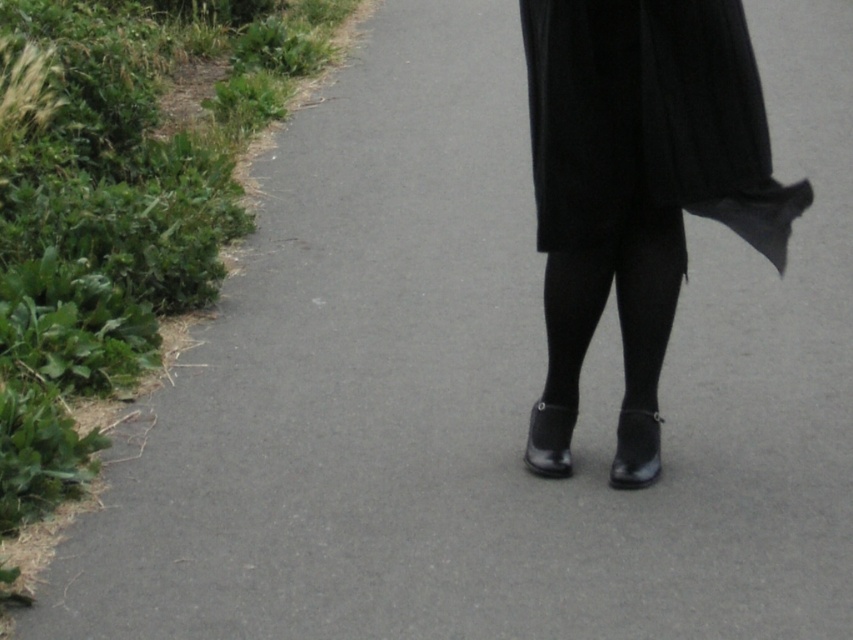
You are a photographer trying to capture the black matte skirt at center in your shot. Based on the scene description, where should you position your camera relative to the skirt to ensure it is centered in the frame?

The black matte skirt at center is already positioned at the center of the image, so you should center your camera directly on it to ensure it remains centered in the frame.

You are a fashion designer observing the image. You need to determine which item of clothing is bigger in size between the black matte skirt at center and the black tights at center. Which one is larger?

The black matte skirt at center has a larger size compared to the black tights at center, so the black matte skirt at center is bigger.